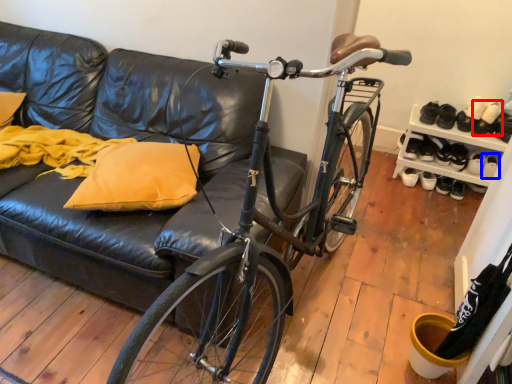
Question: Which object appears closest to the camera in this image, footwear (highlighted by a red box) or footwear (highlighted by a blue box)?

Choices:
 (A) footwear
 (B) footwear

Answer: (A)